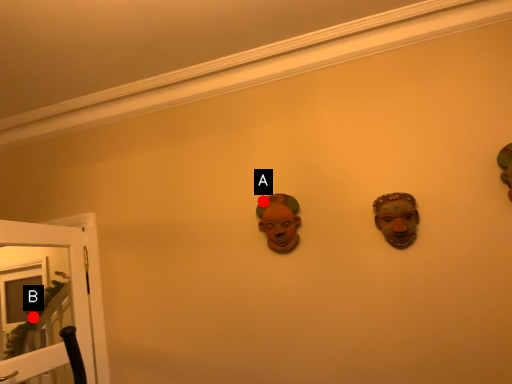
Question: Two points are circled on the image, labeled by A and B beside each circle. Which point appears farthest from the camera in this image?

Choices:
 (A) A is further
 (B) B is further

Answer: (B)